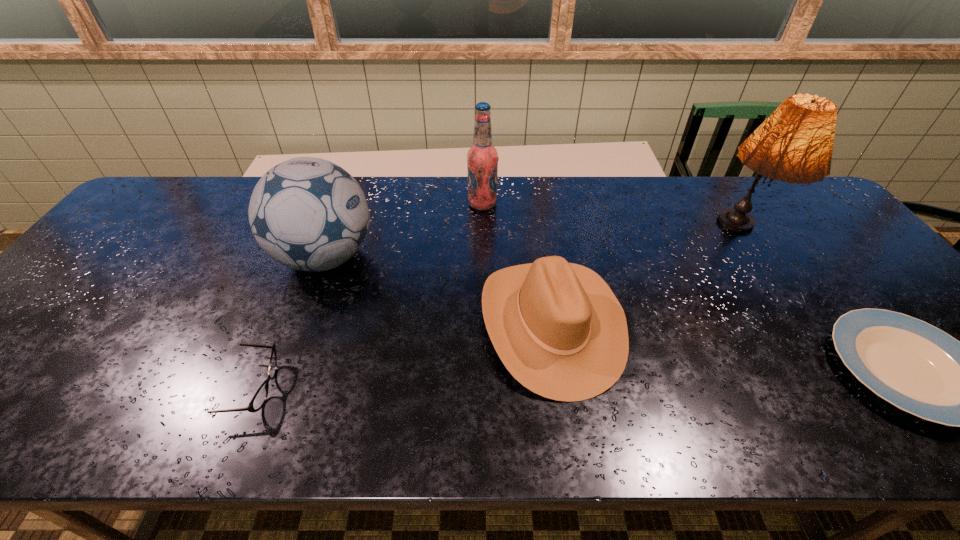
Identify the location of the tallest object. (794, 144).

At what (x,y) coordinates should I click in order to perform the action: click on alcohol. Please return your answer as a coordinate pair (x, y). Looking at the image, I should click on (482, 157).

This screenshot has width=960, height=540. What are the coordinates of `soccer ball` in the screenshot? It's located at (309, 214).

You are a GUI agent. You are given a task and a screenshot of the screen. Output one action in this format:
    pyautogui.click(x=<x>, y=<y>)
    Task: Click on the cowboy hat
    
    Given the screenshot: What is the action you would take?
    pyautogui.click(x=557, y=327)

Image resolution: width=960 pixels, height=540 pixels. Identify the location of the fifth tallest object. (259, 399).

The width and height of the screenshot is (960, 540). I want to click on vacant region located 0.390m on the front-facing side of the tallest object, so click(837, 392).

This screenshot has width=960, height=540. Find the location of `blank space located 0.070m on the front of the alcohol`. blank space located 0.070m on the front of the alcohol is located at coordinates coord(483,227).

I want to click on vacant space situated 0.350m on the side with brand of the soccer ball, so click(x=503, y=258).

Identify the location of free point located on the back of the cowboy hat. This screenshot has height=540, width=960. (540, 244).

This screenshot has width=960, height=540. What are the coordinates of `vacant space located on the front-facing side of the second shortest object` in the screenshot? It's located at (313, 388).